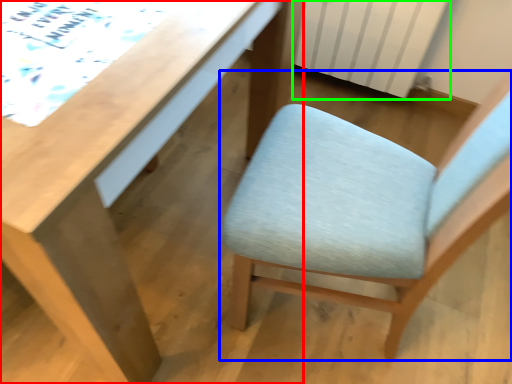
Question: Which is farther away from desk (highlighted by a red box)? chair (highlighted by a blue box) or radiator (highlighted by a green box)?

Choices:
 (A) chair
 (B) radiator

Answer: (B)